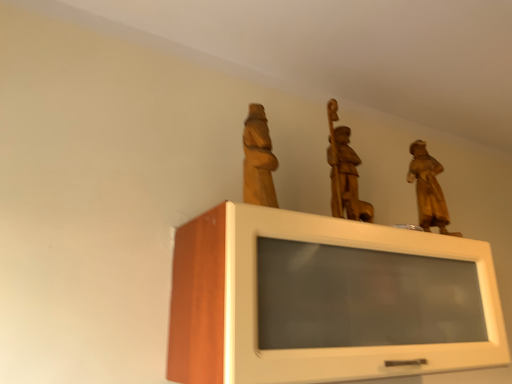
Question: Should I look upward or downward to see wooden statue at center, which is the 2th sculpture in left-to-right order?

Choices:
 (A) up
 (B) down

Answer: (A)

Question: From a real-world perspective, is wooden statue at upper right, arranged as the first sculpture when viewed from the right, beneath wooden statue at center, which is the 2th sculpture in left-to-right order?

Choices:
 (A) yes
 (B) no

Answer: (A)

Question: From a real-world perspective, does wooden statue at upper right, the third sculpture positioned from the left, stand above wooden statue at center, arranged as the 2th sculpture when viewed from the right?

Choices:
 (A) yes
 (B) no

Answer: (B)

Question: Is wooden statue at upper right, the third sculpture positioned from the left, turned away from wooden statue at center, arranged as the 2th sculpture when viewed from the right?

Choices:
 (A) no
 (B) yes

Answer: (A)

Question: Is wooden statue at upper right, the third sculpture positioned from the left, positioned behind wooden statue at center, arranged as the 2th sculpture when viewed from the right?

Choices:
 (A) no
 (B) yes

Answer: (B)

Question: Is wooden statue at upper right, the third sculpture positioned from the left, at the right side of wooden statue at center, which is the 2th sculpture in left-to-right order?

Choices:
 (A) no
 (B) yes

Answer: (B)

Question: Is wooden statue at upper right, arranged as the first sculpture when viewed from the right, completely or partially outside of wooden statue at center, arranged as the 2th sculpture when viewed from the right?

Choices:
 (A) yes
 (B) no

Answer: (A)

Question: Does white glossy cabinet at upper center have a larger size compared to wooden statue at center, which is the 2th sculpture in left-to-right order?

Choices:
 (A) yes
 (B) no

Answer: (A)

Question: Is white glossy cabinet at upper center shorter than wooden statue at center, which is the 2th sculpture in left-to-right order?

Choices:
 (A) no
 (B) yes

Answer: (A)

Question: Can you confirm if white glossy cabinet at upper center is taller than wooden statue at center, arranged as the 2th sculpture when viewed from the right?

Choices:
 (A) no
 (B) yes

Answer: (B)

Question: Is wooden statue at center, arranged as the 2th sculpture when viewed from the right, a part of white glossy cabinet at upper center?

Choices:
 (A) yes
 (B) no

Answer: (B)

Question: Is white glossy cabinet at upper center further to camera compared to wooden statue at center, arranged as the 2th sculpture when viewed from the right?

Choices:
 (A) no
 (B) yes

Answer: (A)

Question: Does white glossy cabinet at upper center have a lesser width compared to wooden statue at center, which is the 2th sculpture in left-to-right order?

Choices:
 (A) no
 (B) yes

Answer: (A)

Question: Is wooden statue at center, which is the 2th sculpture in left-to-right order, next to white glossy cabinet at upper center and touching it?

Choices:
 (A) yes
 (B) no

Answer: (B)